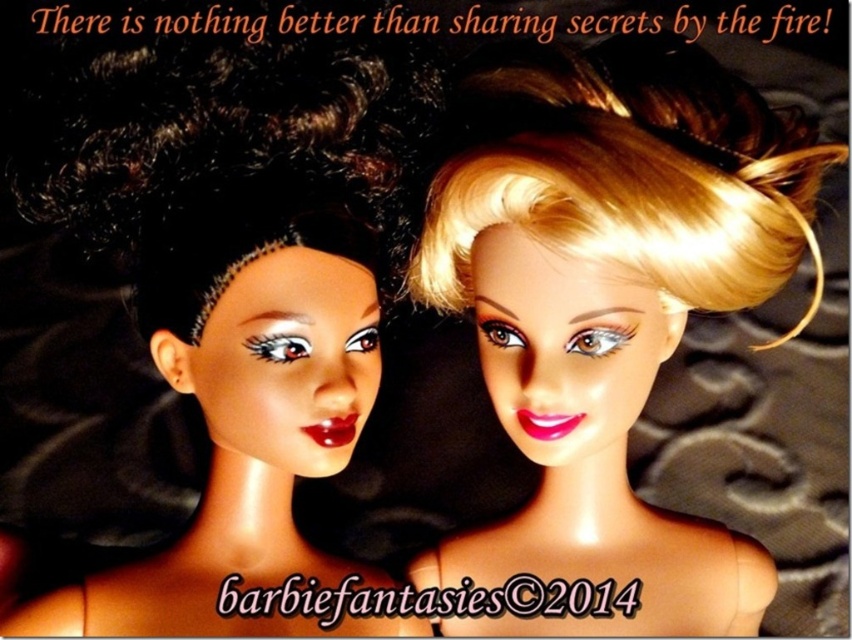
Consider the image. You are positioning a small microphone to capture the conversation between the two dolls. The microphone needs to be placed exactly halfway between the shiny blonde hair at center and the other doll. Where should you place the microphone?

The shiny blonde hair at center is located at point (608,301). To place the microphone halfway between it and the other doll, you would need to calculate the midpoint between their coordinates. However, the exact coordinates of the other doll are not provided, so precise placement isn

You are a photographer setting up a shoot with the shiny blonde hair at center and the matte black doll at left. You need to ensure that the taller object is placed in the foreground to create a depth effect. Which doll should be positioned closer to the camera?

The shiny blonde hair at center is much taller than the matte black doll at left, so to create a depth effect, the taller shiny blonde hair at center should be positioned closer to the camera.